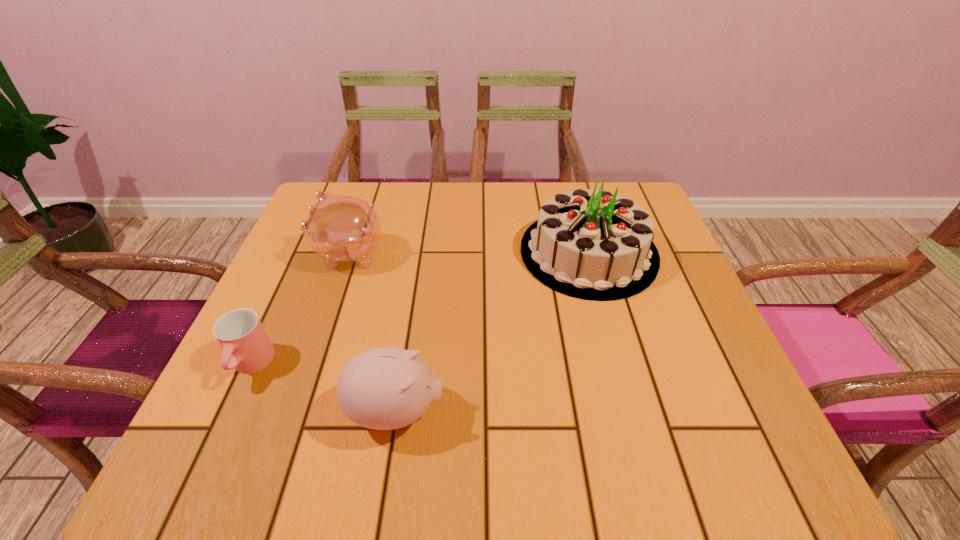
This screenshot has width=960, height=540. In order to click on object that is at the far edge in this screenshot , I will do `click(590, 244)`.

Find the location of `object present at the near edge`. object present at the near edge is located at coordinates (386, 388).

This screenshot has width=960, height=540. I want to click on piggy bank that is at the left edge, so click(338, 228).

Image resolution: width=960 pixels, height=540 pixels. Identify the location of cup that is at the left edge. (240, 333).

Find the location of a particular element. Image resolution: width=960 pixels, height=540 pixels. object that is at the right edge is located at coordinates (590, 244).

What are the coordinates of `object that is at the far right corner` in the screenshot? It's located at (590, 244).

In the image, there is a desktop. Identify the location of vacant region at the far edge. (399, 215).

Where is `vacant space at the near edge`? vacant space at the near edge is located at coordinates (562, 437).

You are a GUI agent. You are given a task and a screenshot of the screen. Output one action in this format:
    pyautogui.click(x=<x>, y=<y>)
    Task: Click on the vacant space at the left edge
    The height and width of the screenshot is (540, 960).
    Given the screenshot: What is the action you would take?
    pyautogui.click(x=304, y=307)

Image resolution: width=960 pixels, height=540 pixels. In the image, there is a desktop. In order to click on free space at the right edge in this screenshot , I will do `click(691, 305)`.